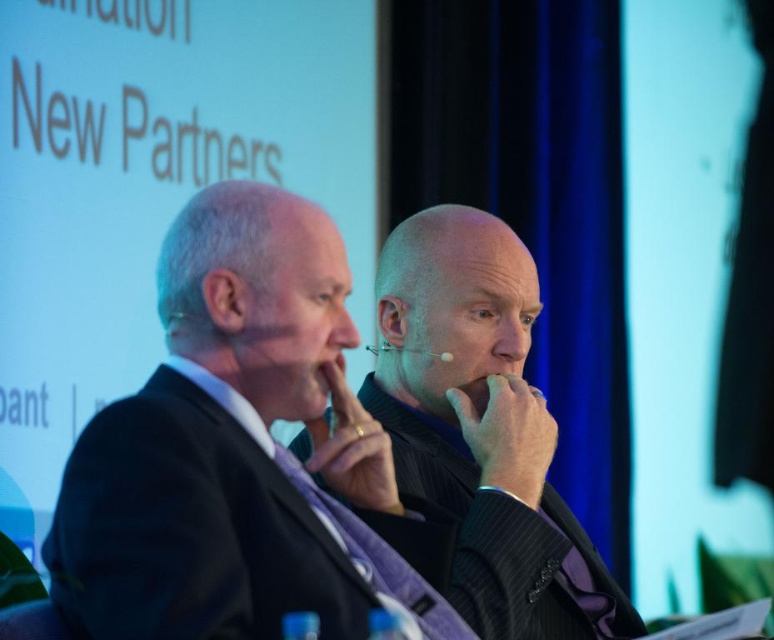
Question: Is black pinstripe suit at center positioned at the back of black textured suit at center?

Choices:
 (A) no
 (B) yes

Answer: (A)

Question: Does black pinstripe suit at center appear on the left side of black textured suit at center?

Choices:
 (A) yes
 (B) no

Answer: (A)

Question: Which of the following is the closest to the observer?

Choices:
 (A) black textured suit at center
 (B) black pinstripe suit at center

Answer: (B)

Question: Which point is closer to the camera taking this photo?

Choices:
 (A) (497, 336)
 (B) (344, 577)

Answer: (B)

Question: Is black pinstripe suit at center wider than black textured suit at center?

Choices:
 (A) no
 (B) yes

Answer: (B)

Question: Which object appears farthest from the camera in this image?

Choices:
 (A) black textured suit at center
 (B) black pinstripe suit at center

Answer: (A)